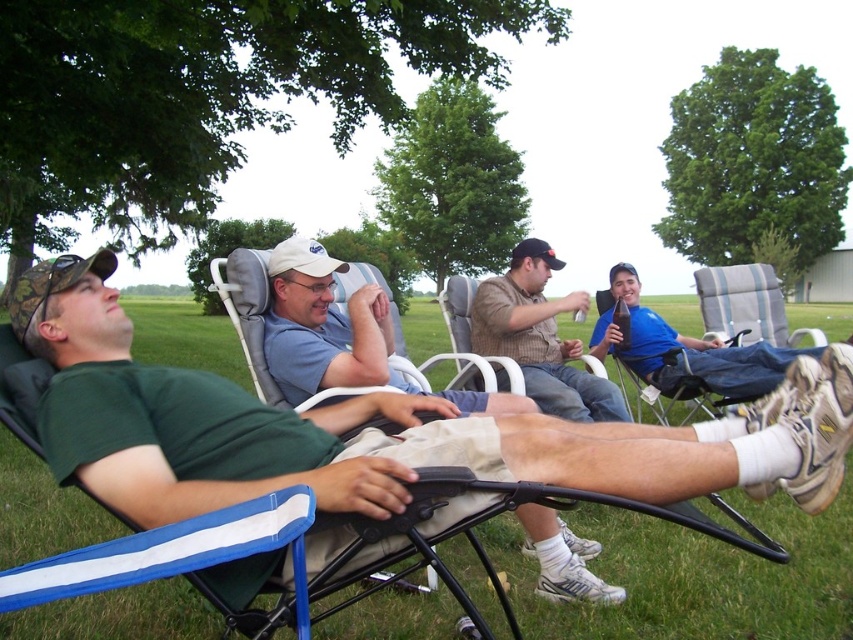
You are standing in the center of the grassy field and want to move towards the striped fabric beach chair at right. Which direction should you walk to avoid the green fabric chair at left?

The green fabric chair at left is positioned under the striped fabric beach chair at right, so to avoid the green fabric chair at left, you should walk directly towards the striped fabric beach chair at right as it is above the green one in your view.

You are standing at the origin point of the coordinate system. Which direction should you move to reach the green fabric chair at left?

Since the green fabric chair at left is located at coordinate point 0.672 on the x axis and 0.442 on the y axis, you should move northeast to reach it.